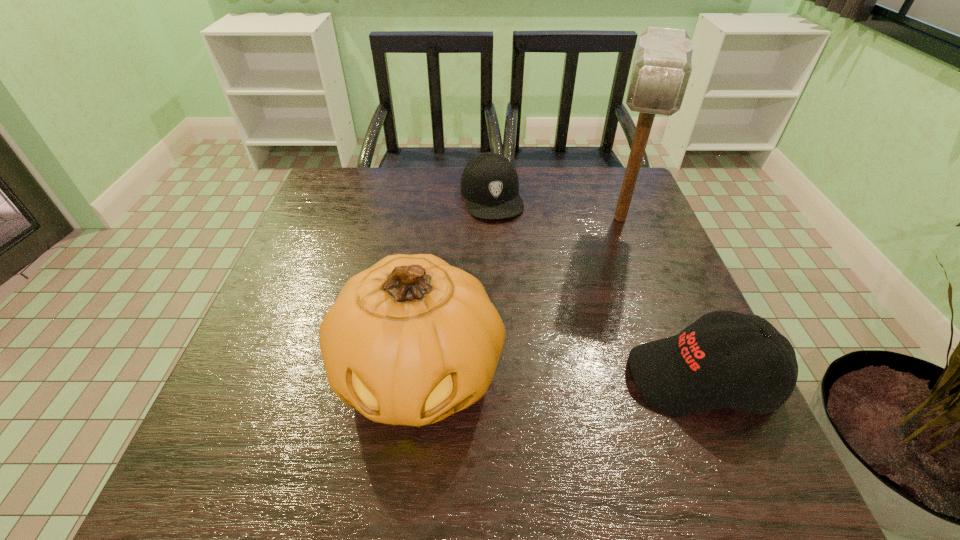
Where is `vacant space located on the front-facing side of the shortest object`? This screenshot has width=960, height=540. vacant space located on the front-facing side of the shortest object is located at coordinates click(515, 280).

In order to click on free space located 0.160m on the front-facing side of the shortest object in this screenshot , I will do `click(510, 262)`.

Where is `free space located on the front-facing side of the shortest object`? This screenshot has width=960, height=540. free space located on the front-facing side of the shortest object is located at coordinates (530, 330).

This screenshot has width=960, height=540. I want to click on mallet that is at the far edge, so click(x=662, y=68).

Identify the location of cap positioned at the far edge. (489, 183).

Locate an element on the screen. The height and width of the screenshot is (540, 960). pumpkin at the near edge is located at coordinates (411, 340).

Identify the location of baseball cap at the near edge. Image resolution: width=960 pixels, height=540 pixels. (688, 373).

Identify the location of baseball cap that is at the right edge. Image resolution: width=960 pixels, height=540 pixels. (688, 373).

Identify the location of mallet that is at the right edge. This screenshot has width=960, height=540. (662, 68).

Where is `object at the far right corner`? Image resolution: width=960 pixels, height=540 pixels. object at the far right corner is located at coordinates (662, 68).